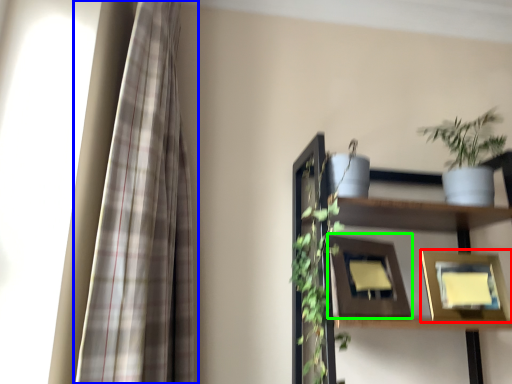
Question: Based on their relative distances, which object is nearer to picture frame (highlighted by a red box)? Choose from curtain (highlighted by a blue box) and picture frame (highlighted by a green box).

Choices:
 (A) curtain
 (B) picture frame

Answer: (B)